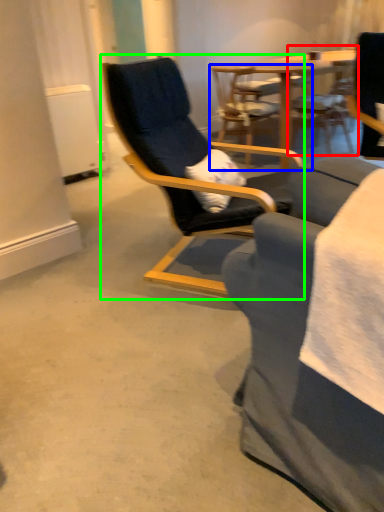
Question: Which object is positioned farthest from chair (highlighted by a red box)? Select from chair (highlighted by a blue box) and chair (highlighted by a green box).

Choices:
 (A) chair
 (B) chair

Answer: (B)